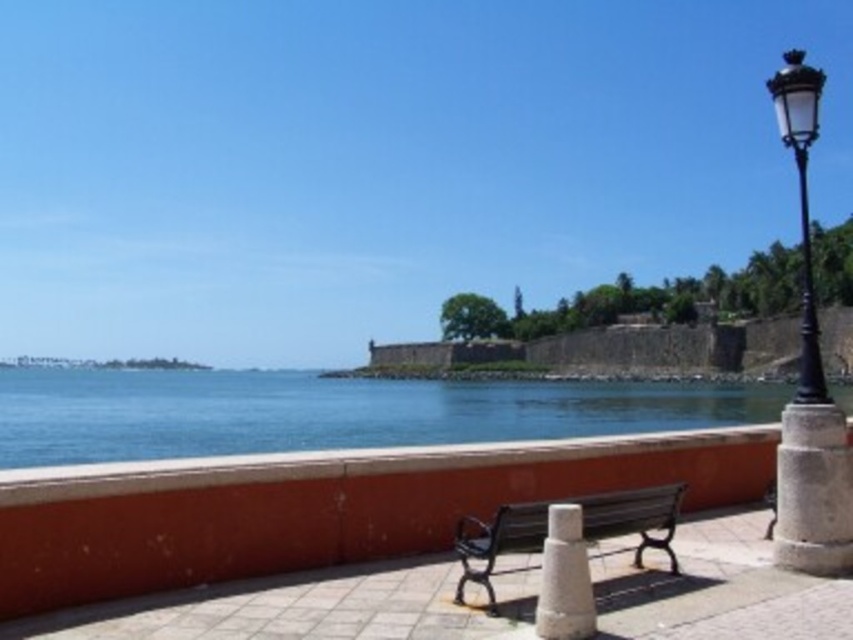
You are a maintenance worker who needs to replace a part for the black metal bench at center. You have a tool that can only lift objects up to the size of the black metal pole at right. Will the tool be sufficient for the task?

The black metal bench at center has a smaller size compared to the black metal pole at right. Since the tool can lift objects up to the size of the black metal pole at right, it will be sufficient for replacing the part on the smaller black metal bench at center.

You are a maintenance worker needing to replace a part that requires a ladder. You see the black metal bench at center and the black metal pole at right. Which object is taller, requiring you to bring a ladder?

The black metal pole at right is taller than the black metal bench at center, so you should bring a ladder to reach it.

Looking at this image, you are standing at the waterfront and see two points marked in the scene. Which point is closer to you, point (180, 417) or point (561, 586)?

Point (561, 586) is closer to you because point (180, 417) is further away from the camera.